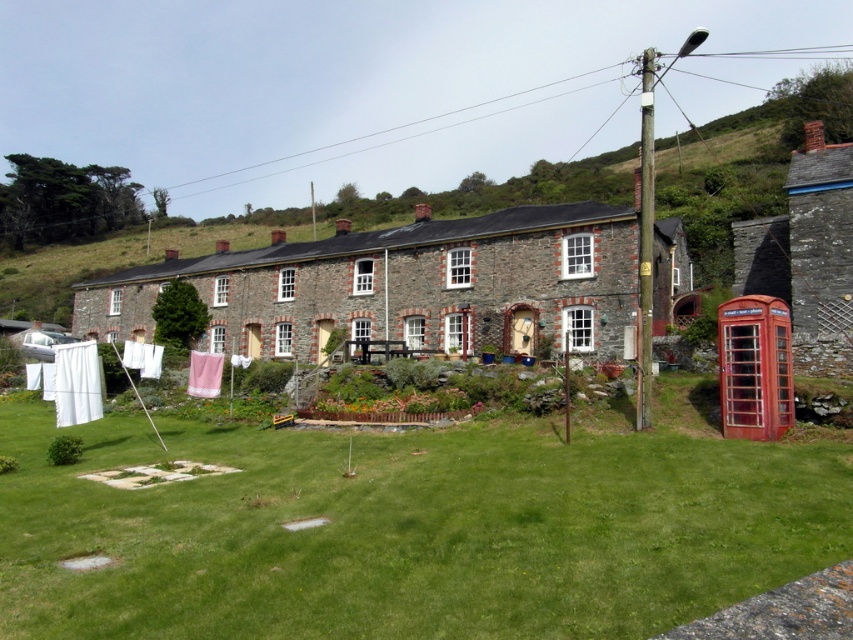
Question: Does green grass at lower center come in front of rustic stone cottage at center?

Choices:
 (A) yes
 (B) no

Answer: (A)

Question: Is green grass at lower center positioned at the back of rustic stone cottage at center?

Choices:
 (A) no
 (B) yes

Answer: (A)

Question: Observing the image, what is the correct spatial positioning of green grass at lower center in reference to rustic stone cottage at center?

Choices:
 (A) left
 (B) right

Answer: (A)